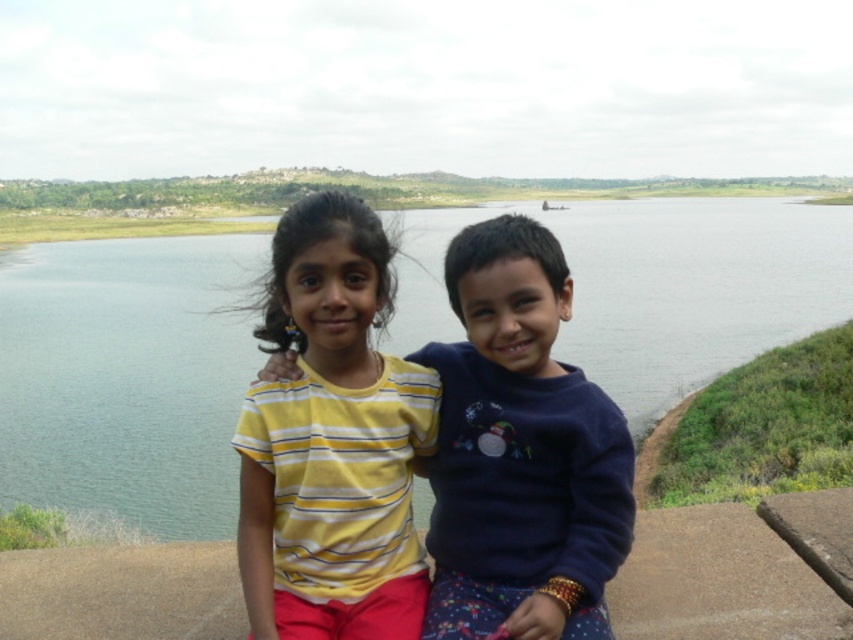
You are a photographer trying to capture a clear shot of the dark blue sweater at center without the blue water at center obstructing it. What adjustment should you make to your camera angle?

The dark blue sweater at center is behind the blue water at center, so you should adjust your camera angle to focus on the dark blue sweater at center by moving the camera forward or tilting it upward to avoid the blue water at center.

You are standing in the scene described. Where is the blue water at center located in terms of coordinates?

The blue water at center is located at coordinates point (126, 380).